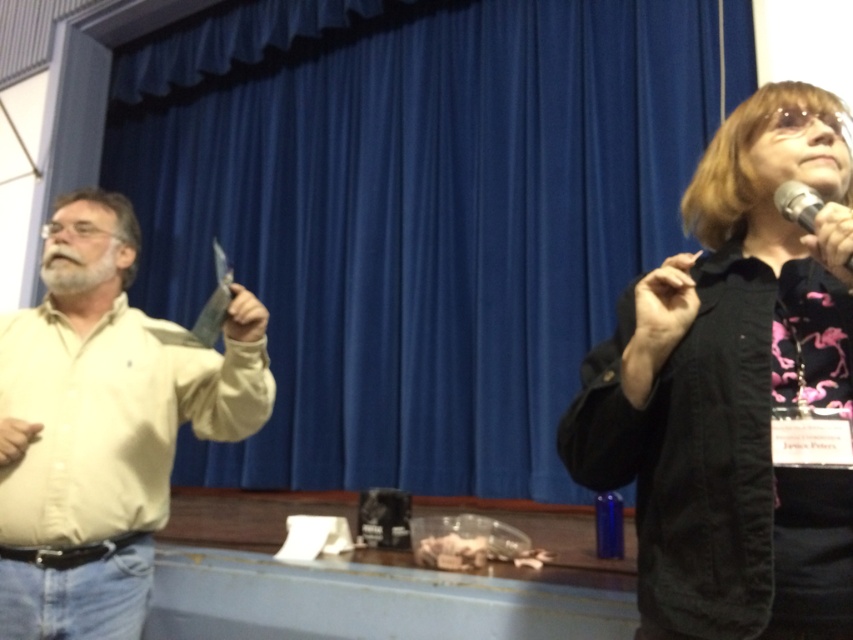
You are a stagehand who needs to adjust the microphone stand so that the black metallic microphone at upper right is exactly 10 inches away from the black matte jacket at upper right. Currently, the distance between them is 8.01 inches. Should you move the microphone stand closer to or farther away from the jacket?

The black matte jacket at upper right is 8.01 inches from the black metallic microphone at upper right. To reach the desired 10 inches, you should move the microphone stand farther away from the jacket.

You are an event planner setting up a stage for a presentation. You need to ensure that the blue fabric curtain at center is visible behind the speaker wearing the light yellow shirt at left. Based on their heights, will the curtain be tall enough to serve as a proper backdrop?

The blue fabric curtain at center is taller than the light yellow shirt at left, so yes, the curtain will be tall enough to serve as a proper backdrop behind the speaker wearing the light yellow shirt at left.